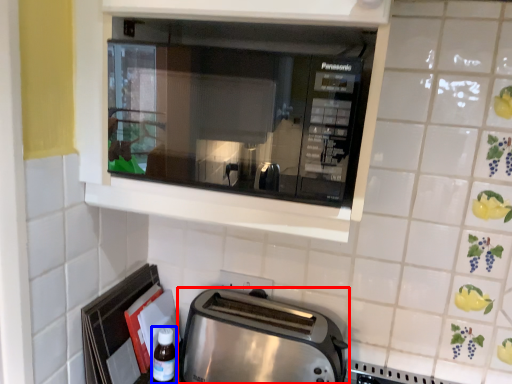
Question: Which point is further to the camera, toaster (highlighted by a red box) or bottle (highlighted by a blue box)?

Choices:
 (A) toaster
 (B) bottle

Answer: (B)